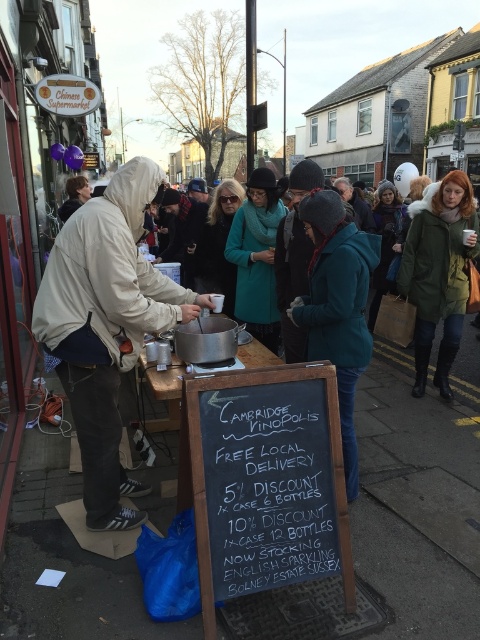
Image resolution: width=480 pixels, height=640 pixels. In order to click on black chalkboard at center in this screenshot , I will do `click(264, 481)`.

Who is taller, black chalkboard at center or white fleece jacket at center?

Standing taller between the two is white fleece jacket at center.

Is point (319, 390) farther from viewer compared to point (117, 266)?

No, (319, 390) is closer to viewer.

This screenshot has height=640, width=480. Identify the location of black chalkboard at center. (264, 481).